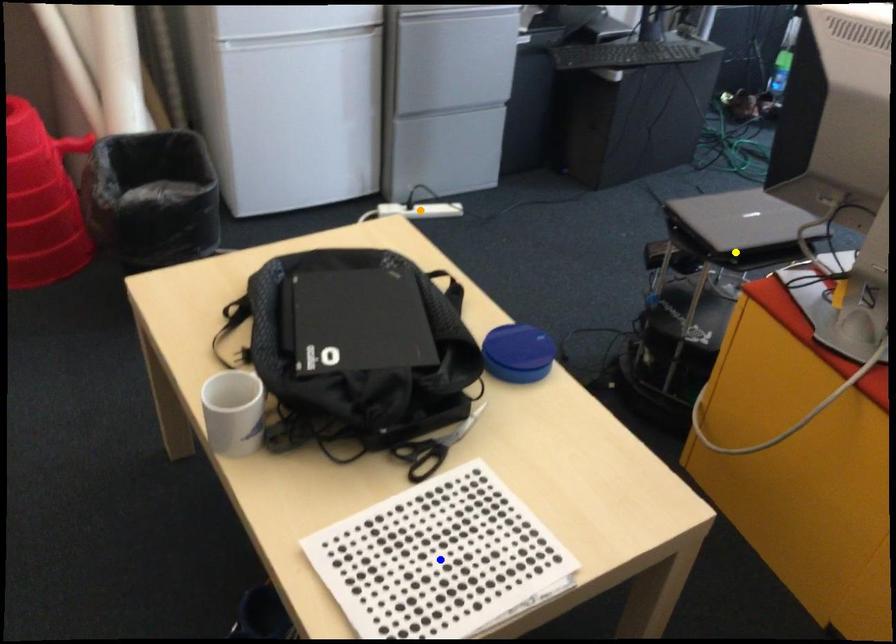
Order these from nearest to farthest:
- blue point
- yellow point
- orange point

blue point
yellow point
orange point